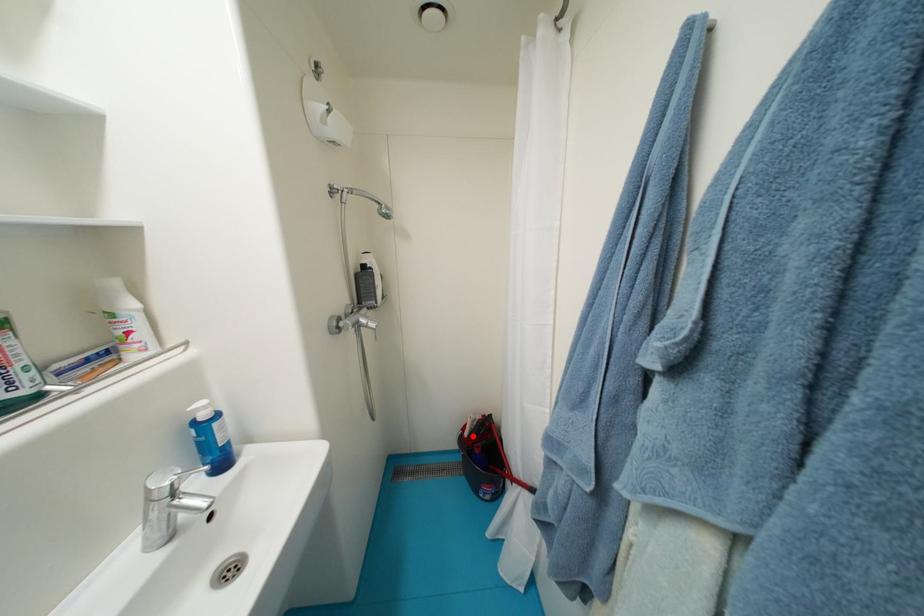
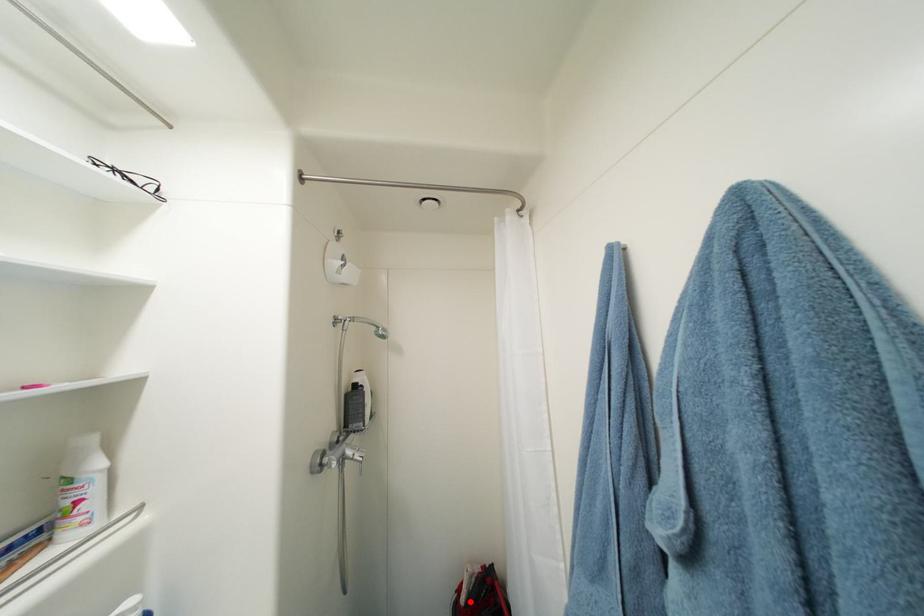
I am providing you with two images of the same scene from different viewpoints. A red point is marked on the first image and another point is marked on the second image. Do the highlighted points in image1 and image2 indicate the same real-world spot?

Yes